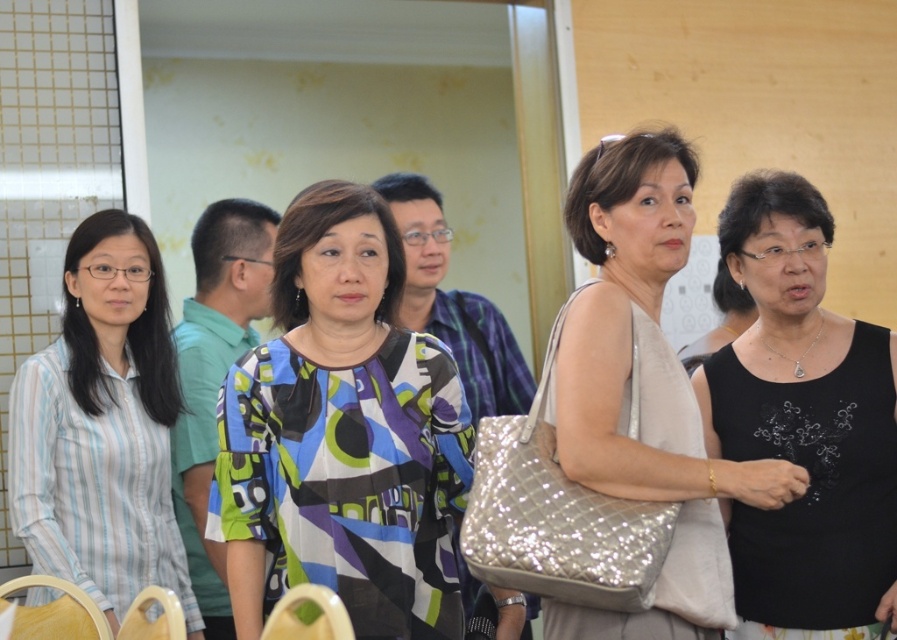
Question: Is light blue striped shirt at left below blue printed shirt at center?

Choices:
 (A) yes
 (B) no

Answer: (A)

Question: Can you confirm if matte beige purse at center is thinner than blue printed shirt at center?

Choices:
 (A) yes
 (B) no

Answer: (B)

Question: Which object is closer to the camera taking this photo?

Choices:
 (A) printed fabric blouse at center
 (B) black matte tank top at center
 (C) printed fabric shirt at center
 (D) blue printed shirt at center

Answer: (A)

Question: Estimate the real-world distances between objects in this image. Which object is farther from the blue printed shirt at center?

Choices:
 (A) black matte tank top at center
 (B) matte beige purse at center

Answer: (A)

Question: Does printed fabric blouse at center have a smaller size compared to matte beige purse at center?

Choices:
 (A) yes
 (B) no

Answer: (A)

Question: Which of the following is the farthest from the observer?

Choices:
 (A) (521, 356)
 (B) (800, 556)

Answer: (A)